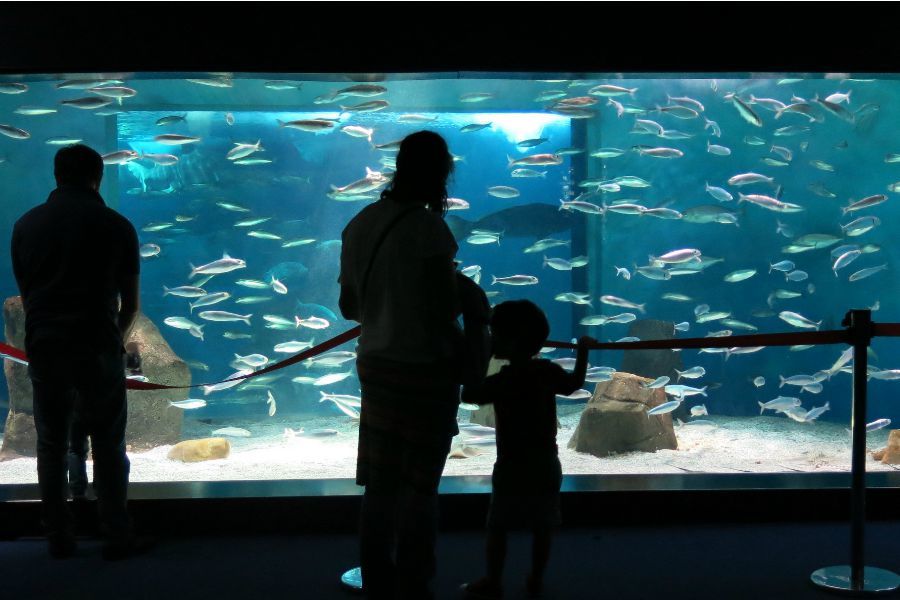
Locate an element on the screen. black frame surrounding the aquarium is located at coordinates (15, 512), (307, 500), (687, 496), (887, 498), (878, 29), (533, 33), (246, 36).